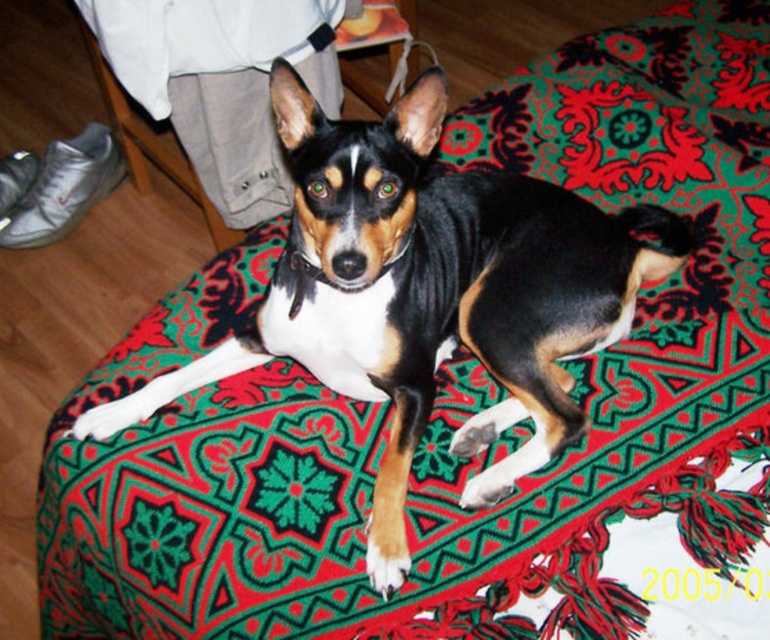
Question: Can you confirm if black and tan fur dog at center is positioned to the right of patterned fabric cushion at center?

Choices:
 (A) yes
 (B) no

Answer: (A)

Question: Which object is farther from the camera taking this photo?

Choices:
 (A) patterned fabric cushion at center
 (B) black and tan fur dog at center

Answer: (A)

Question: Can you confirm if black and tan fur dog at center is smaller than patterned fabric cushion at center?

Choices:
 (A) yes
 (B) no

Answer: (B)

Question: In this image, where is black and tan fur dog at center located relative to patterned fabric cushion at center?

Choices:
 (A) right
 (B) left

Answer: (A)